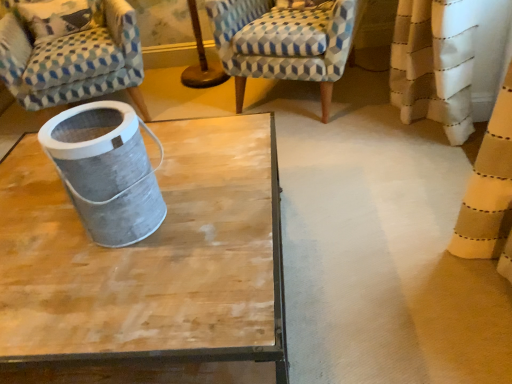
Image resolution: width=512 pixels, height=384 pixels. What do you see at coordinates (284, 53) in the screenshot? I see `patterned fabric armchair at upper center, the second chair when ordered from left to right` at bounding box center [284, 53].

Measure the distance between point (228, 65) and camera.

A distance of 2.20 meters exists between point (228, 65) and camera.

Locate an element on the screen. Image resolution: width=512 pixels, height=384 pixels. patterned fabric armchair at upper center, marked as the 1th chair in a right-to-left arrangement is located at coordinates click(x=284, y=53).

In order to click on patterned fabric armchair at upper left, the 2th chair in the right-to-left sequence in this screenshot , I will do pyautogui.click(x=70, y=52).

The width and height of the screenshot is (512, 384). Describe the element at coordinates (70, 52) in the screenshot. I see `patterned fabric armchair at upper left, which ranks as the first chair in left-to-right order` at that location.

This screenshot has width=512, height=384. I want to click on patterned fabric armchair at upper center, the second chair when ordered from left to right, so click(284, 53).

Which is more to the left, patterned fabric armchair at upper left, the 2th chair in the right-to-left sequence, or patterned fabric armchair at upper center, marked as the 1th chair in a right-to-left arrangement?

patterned fabric armchair at upper left, the 2th chair in the right-to-left sequence, is more to the left.

Between patterned fabric armchair at upper left, which ranks as the first chair in left-to-right order, and patterned fabric armchair at upper center, the second chair when ordered from left to right, which one is positioned in front?

patterned fabric armchair at upper center, the second chair when ordered from left to right.

Is point (120, 58) closer or farther from the camera than point (333, 33)?

Point (120, 58).

From the image's perspective, between patterned fabric armchair at upper left, the 2th chair in the right-to-left sequence, and patterned fabric armchair at upper center, the second chair when ordered from left to right, which one is located above?

patterned fabric armchair at upper center, the second chair when ordered from left to right.

From a real-world perspective, who is located lower, patterned fabric armchair at upper left, the 2th chair in the right-to-left sequence, or patterned fabric armchair at upper center, the second chair when ordered from left to right?

From a 3D spatial view, patterned fabric armchair at upper center, the second chair when ordered from left to right, is below.

Does patterned fabric armchair at upper left, which ranks as the first chair in left-to-right order, have a lesser width compared to patterned fabric armchair at upper center, marked as the 1th chair in a right-to-left arrangement?

No, patterned fabric armchair at upper left, which ranks as the first chair in left-to-right order, is not thinner than patterned fabric armchair at upper center, marked as the 1th chair in a right-to-left arrangement.

Between patterned fabric armchair at upper left, which ranks as the first chair in left-to-right order, and patterned fabric armchair at upper center, marked as the 1th chair in a right-to-left arrangement, which one has more height?

With more height is patterned fabric armchair at upper left, which ranks as the first chair in left-to-right order.

Who is smaller, patterned fabric armchair at upper left, which ranks as the first chair in left-to-right order, or patterned fabric armchair at upper center, marked as the 1th chair in a right-to-left arrangement?

With smaller size is patterned fabric armchair at upper center, marked as the 1th chair in a right-to-left arrangement.

Is patterned fabric armchair at upper left, the 2th chair in the right-to-left sequence, spatially inside patterned fabric armchair at upper center, the second chair when ordered from left to right, or outside of it?

patterned fabric armchair at upper left, the 2th chair in the right-to-left sequence, cannot be found inside patterned fabric armchair at upper center, the second chair when ordered from left to right.

Is patterned fabric armchair at upper left, which ranks as the first chair in left-to-right order, with patterned fabric armchair at upper center, the second chair when ordered from left to right?

patterned fabric armchair at upper left, which ranks as the first chair in left-to-right order, and patterned fabric armchair at upper center, the second chair when ordered from left to right, are not in contact.

Could you tell me if patterned fabric armchair at upper left, which ranks as the first chair in left-to-right order, is turned towards patterned fabric armchair at upper center, the second chair when ordered from left to right?

No, patterned fabric armchair at upper left, which ranks as the first chair in left-to-right order, is not aimed at patterned fabric armchair at upper center, the second chair when ordered from left to right.

How different are the orientations of patterned fabric armchair at upper left, the 2th chair in the right-to-left sequence, and patterned fabric armchair at upper center, marked as the 1th chair in a right-to-left arrangement, in degrees?

41.7 degrees.

This screenshot has width=512, height=384. Identify the location of chair that appears behind the patterned fabric armchair at upper center, marked as the 1th chair in a right-to-left arrangement. click(x=70, y=52).

Based on the photo, is patterned fabric armchair at upper center, marked as the 1th chair in a right-to-left arrangement, to the left or to the right of patterned fabric armchair at upper left, the 2th chair in the right-to-left sequence, in the image?

In the image, patterned fabric armchair at upper center, marked as the 1th chair in a right-to-left arrangement, appears on the right side of patterned fabric armchair at upper left, the 2th chair in the right-to-left sequence.

Is patterned fabric armchair at upper center, the second chair when ordered from left to right, positioned behind patterned fabric armchair at upper left, the 2th chair in the right-to-left sequence?

That is False.

Considering the points (354, 31) and (44, 61), which point is in front, point (354, 31) or point (44, 61)?

The point (44, 61) is in front.

From the image's perspective, is patterned fabric armchair at upper center, the second chair when ordered from left to right, above or below patterned fabric armchair at upper left, which ranks as the first chair in left-to-right order?

From the image's perspective, patterned fabric armchair at upper center, the second chair when ordered from left to right, appears above patterned fabric armchair at upper left, which ranks as the first chair in left-to-right order.

From a real-world perspective, is patterned fabric armchair at upper center, marked as the 1th chair in a right-to-left arrangement, on patterned fabric armchair at upper left, which ranks as the first chair in left-to-right order?

No, from a real-world perspective, patterned fabric armchair at upper center, marked as the 1th chair in a right-to-left arrangement, is not over patterned fabric armchair at upper left, which ranks as the first chair in left-to-right order

Does patterned fabric armchair at upper center, the second chair when ordered from left to right, have a lesser width compared to patterned fabric armchair at upper left, the 2th chair in the right-to-left sequence?

Yes.

Can you confirm if patterned fabric armchair at upper center, the second chair when ordered from left to right, is taller than patterned fabric armchair at upper left, which ranks as the first chair in left-to-right order?

No, patterned fabric armchair at upper center, the second chair when ordered from left to right, is not taller than patterned fabric armchair at upper left, which ranks as the first chair in left-to-right order.

Considering the relative sizes of patterned fabric armchair at upper center, marked as the 1th chair in a right-to-left arrangement, and patterned fabric armchair at upper left, the 2th chair in the right-to-left sequence, in the image provided, is patterned fabric armchair at upper center, marked as the 1th chair in a right-to-left arrangement, bigger than patterned fabric armchair at upper left, the 2th chair in the right-to-left sequence,?

No, patterned fabric armchair at upper center, marked as the 1th chair in a right-to-left arrangement, is not bigger than patterned fabric armchair at upper left, the 2th chair in the right-to-left sequence.

Consider the image. Is patterned fabric armchair at upper center, marked as the 1th chair in a right-to-left arrangement, located outside patterned fabric armchair at upper left, which ranks as the first chair in left-to-right order?

That's correct, patterned fabric armchair at upper center, marked as the 1th chair in a right-to-left arrangement, is outside of patterned fabric armchair at upper left, which ranks as the first chair in left-to-right order.

Is patterned fabric armchair at upper center, marked as the 1th chair in a right-to-left arrangement, directly adjacent to patterned fabric armchair at upper left, the 2th chair in the right-to-left sequence?

No, patterned fabric armchair at upper center, marked as the 1th chair in a right-to-left arrangement, is not beside patterned fabric armchair at upper left, the 2th chair in the right-to-left sequence.

Is patterned fabric armchair at upper center, marked as the 1th chair in a right-to-left arrangement, positioned with its back to patterned fabric armchair at upper left, the 2th chair in the right-to-left sequence?

No, patterned fabric armchair at upper center, marked as the 1th chair in a right-to-left arrangement, is not facing away from patterned fabric armchair at upper left, the 2th chair in the right-to-left sequence.

Locate an element on the screen. chair located behind the patterned fabric armchair at upper center, the second chair when ordered from left to right is located at coordinates pos(70,52).

You are a GUI agent. You are given a task and a screenshot of the screen. Output one action in this format:
    pyautogui.click(x=<x>, y=<y>)
    Task: Click on the chair located behind the patterned fabric armchair at upper center, the second chair when ordered from left to right
    
    Given the screenshot: What is the action you would take?
    pyautogui.click(x=70, y=52)

The width and height of the screenshot is (512, 384). What are the coordinates of `chair in front of the patterned fabric armchair at upper left, which ranks as the first chair in left-to-right order` in the screenshot? It's located at (284, 53).